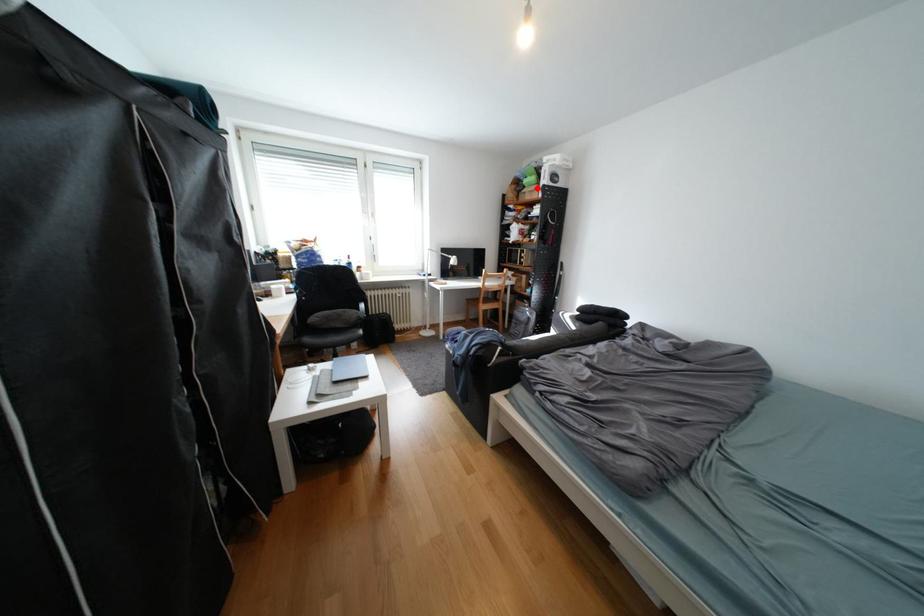
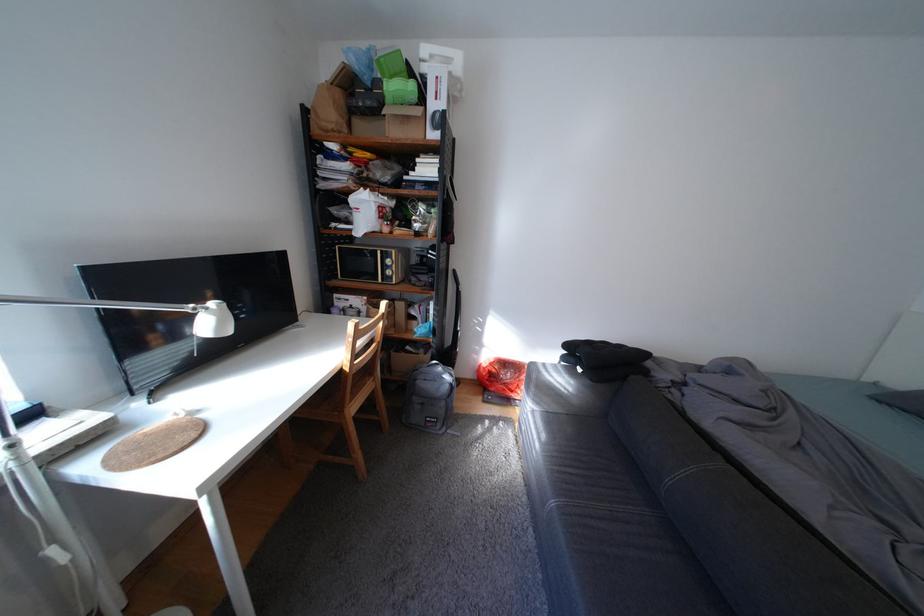
Where in the second image is the point corresponding to the highlighted location from the first image?

(395, 103)